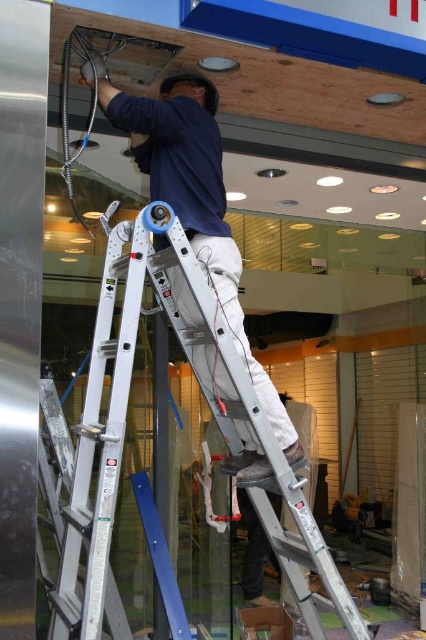
Between point (132, 326) and point (178, 86), which one is positioned in front?

Positioned in front is point (132, 326).

Is point (106, 244) less distant than point (178, 205)?

Yes, point (106, 244) is closer to viewer.

Is point (57, 588) in front of point (201, 237)?

Yes, it is in front of point (201, 237).

Where is `silver/aluminum ladder at center`? The width and height of the screenshot is (426, 640). silver/aluminum ladder at center is located at coordinates (124, 433).